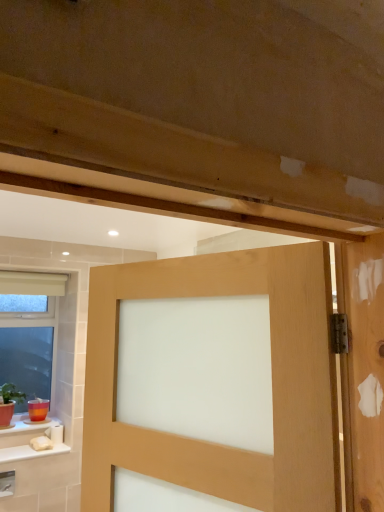
Question: Which is correct: satin wood door at center is inside transparent glass window at lower left, or outside of it?

Choices:
 (A) inside
 (B) outside

Answer: (B)

Question: In the image, is satin wood door at center positioned in front of or behind transparent glass window at lower left?

Choices:
 (A) behind
 (B) front

Answer: (B)

Question: From a real-world perspective, is satin wood door at center positioned above or below transparent glass window at lower left?

Choices:
 (A) below
 (B) above

Answer: (B)

Question: From the image's perspective, is transparent glass window at lower left positioned above or below satin wood door at center?

Choices:
 (A) below
 (B) above

Answer: (A)

Question: Which is correct: transparent glass window at lower left is inside satin wood door at center, or outside of it?

Choices:
 (A) outside
 (B) inside

Answer: (A)

Question: From a real-world perspective, is transparent glass window at lower left physically located above or below satin wood door at center?

Choices:
 (A) below
 (B) above

Answer: (A)

Question: Does point (56, 282) appear closer or farther from the camera than point (195, 456)?

Choices:
 (A) farther
 (B) closer

Answer: (A)